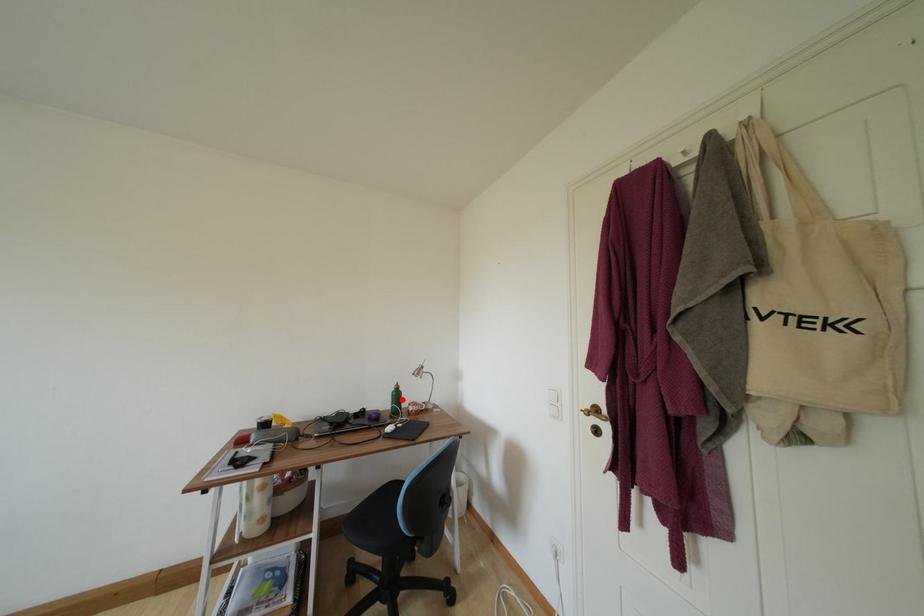
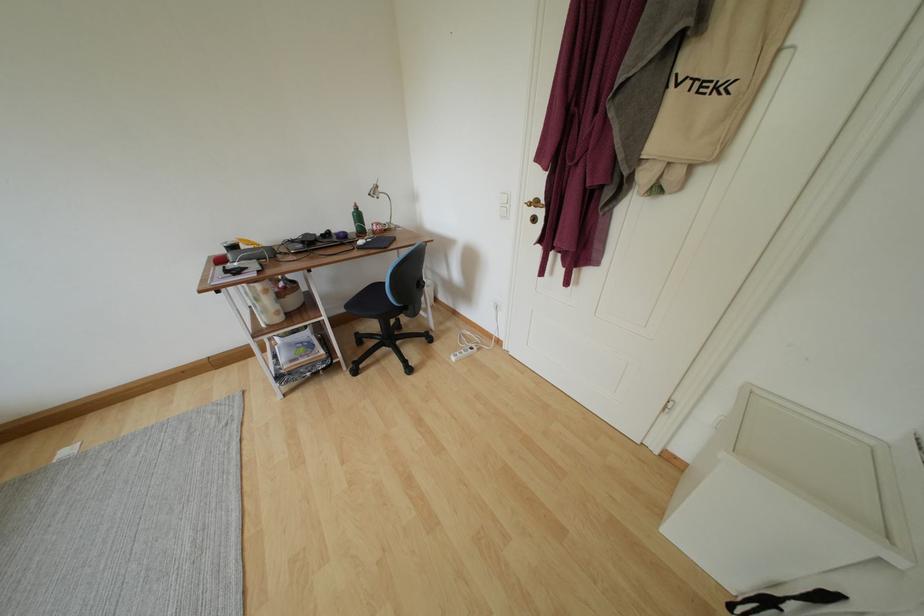
Find the pixel in the second image that matches the highlighted location in the first image.

(363, 220)